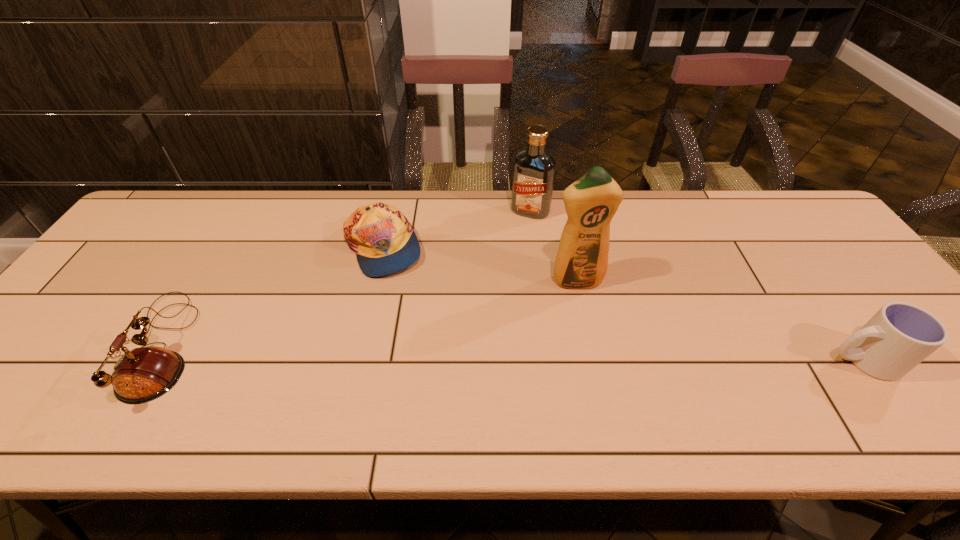
Identify the location of free space on the desktop that is between the leftmost object and the rightmost object and is positioned on the label of the detergent. The width and height of the screenshot is (960, 540). (602, 355).

Identify the location of vacant spot on the desktop that is between the telephone and the rightmost object and is positioned on the front-facing side of the vodka. Image resolution: width=960 pixels, height=540 pixels. (458, 352).

At what (x,y) coordinates should I click in order to perform the action: click on vacant space on the desktop that is between the leftmost object and the rightmost object and is positioned on the bill of the cap. Please return your answer as a coordinate pair (x, y). The height and width of the screenshot is (540, 960). Looking at the image, I should click on (570, 354).